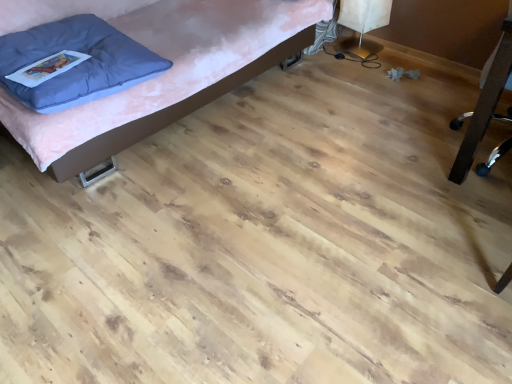
Locate an element on the screen. The image size is (512, 384). vacant area that is situated to the right of matte pink bed at upper left, which ranks as the 1th furniture in left-to-right order is located at coordinates (357, 124).